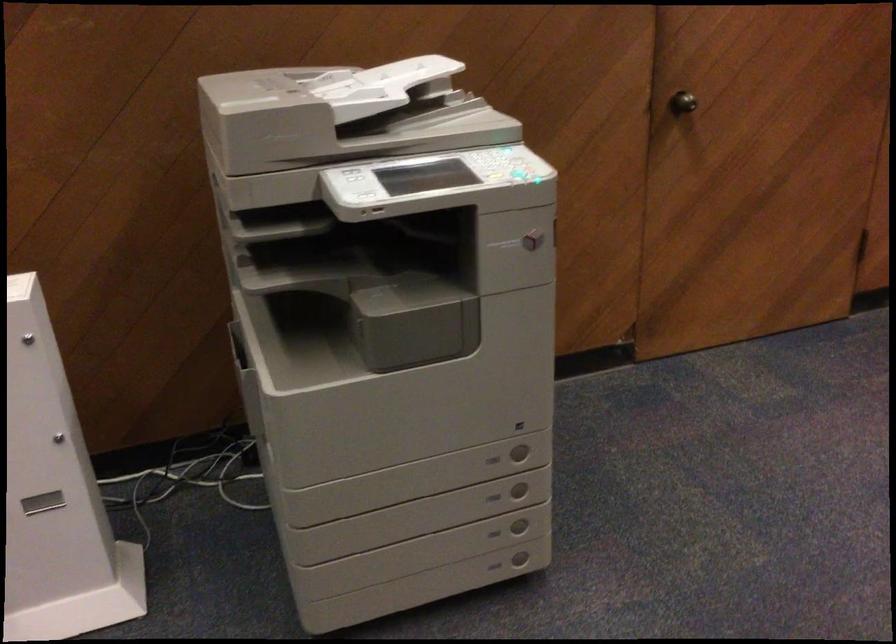
You are a GUI agent. You are given a task and a screenshot of the screen. Output one action in this format:
    pyautogui.click(x=<x>, y=<y>)
    Task: Click on the grey printer button
    
    Given the screenshot: What is the action you would take?
    pyautogui.click(x=354, y=175)